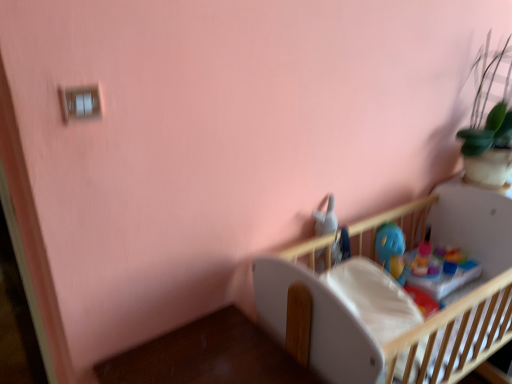
Locate an element on the screen. Image resolution: width=512 pixels, height=384 pixels. free location above white matte table at lower right (from a real-world perspective) is located at coordinates (209, 353).